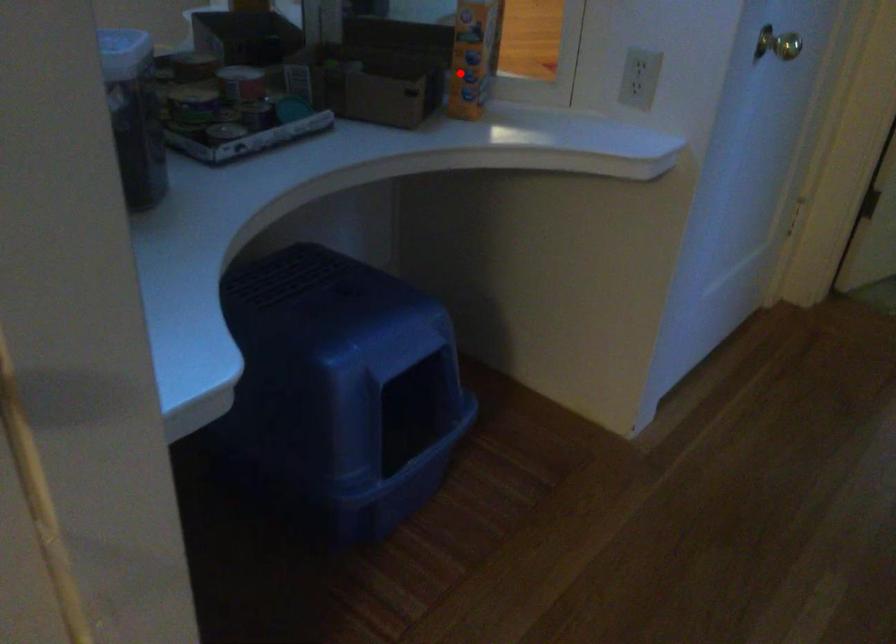
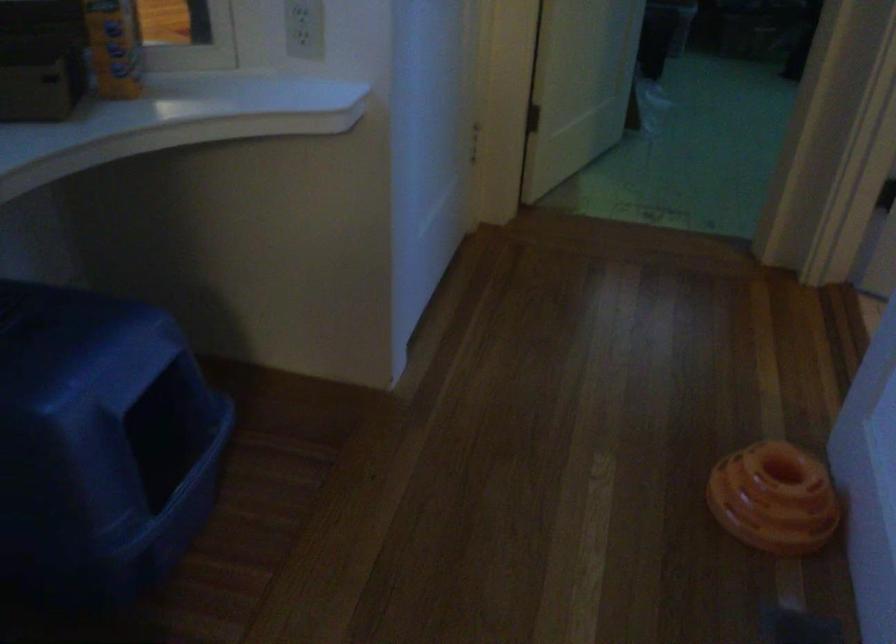
Locate, in the second image, the point that corresponds to the highlighted location in the first image.

(114, 46)